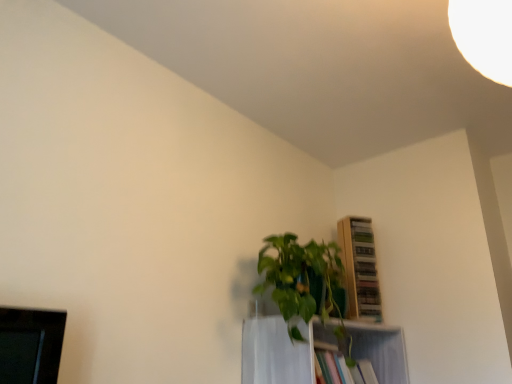
Question: From the image's perspective, is white glossy shelf at center, which is counted as the second shelf, starting from the top, on top of green leafy plant at center?

Choices:
 (A) yes
 (B) no

Answer: (B)

Question: From the image's perspective, would you say white glossy shelf at center, placed as the first shelf when sorted from bottom to top, is shown under green leafy plant at center?

Choices:
 (A) yes
 (B) no

Answer: (A)

Question: Considering the relative positions of white glossy shelf at center, which is counted as the second shelf, starting from the top, and green leafy plant at center in the image provided, is white glossy shelf at center, which is counted as the second shelf, starting from the top, to the right of green leafy plant at center from the viewer's perspective?

Choices:
 (A) yes
 (B) no

Answer: (A)

Question: From a real-world perspective, does white glossy shelf at center, which is counted as the second shelf, starting from the top, stand above green leafy plant at center?

Choices:
 (A) yes
 (B) no

Answer: (B)

Question: Is the position of white glossy shelf at center, placed as the first shelf when sorted from bottom to top, less distant than that of green leafy plant at center?

Choices:
 (A) yes
 (B) no

Answer: (B)

Question: Does white glossy shelf at center, placed as the first shelf when sorted from bottom to top, turn towards green leafy plant at center?

Choices:
 (A) no
 (B) yes

Answer: (A)

Question: Is green leafy plant at center closer to camera compared to wooden shelf at upper right, the 2th shelf ordered from the bottom?

Choices:
 (A) no
 (B) yes

Answer: (B)

Question: Is green leafy plant at center at the left side of wooden shelf at upper right, which ranks as the 1th shelf in top-to-bottom order?

Choices:
 (A) no
 (B) yes

Answer: (B)

Question: Does green leafy plant at center contain wooden shelf at upper right, the 2th shelf ordered from the bottom?

Choices:
 (A) no
 (B) yes

Answer: (A)

Question: Is green leafy plant at center outside wooden shelf at upper right, the 2th shelf ordered from the bottom?

Choices:
 (A) no
 (B) yes

Answer: (B)

Question: Considering the relative sizes of green leafy plant at center and wooden shelf at upper right, the 2th shelf ordered from the bottom, in the image provided, is green leafy plant at center smaller than wooden shelf at upper right, the 2th shelf ordered from the bottom,?

Choices:
 (A) yes
 (B) no

Answer: (B)

Question: From a real-world perspective, does green leafy plant at center sit lower than wooden shelf at upper right, which ranks as the 1th shelf in top-to-bottom order?

Choices:
 (A) yes
 (B) no

Answer: (A)

Question: From a real-world perspective, is wooden shelf at upper right, which ranks as the 1th shelf in top-to-bottom order, on top of green leafy plant at center?

Choices:
 (A) yes
 (B) no

Answer: (A)